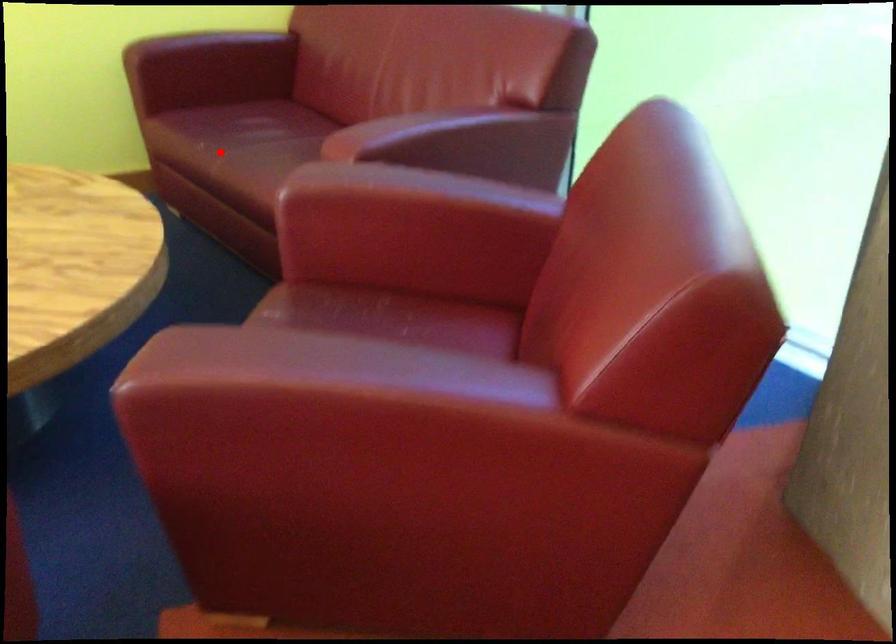
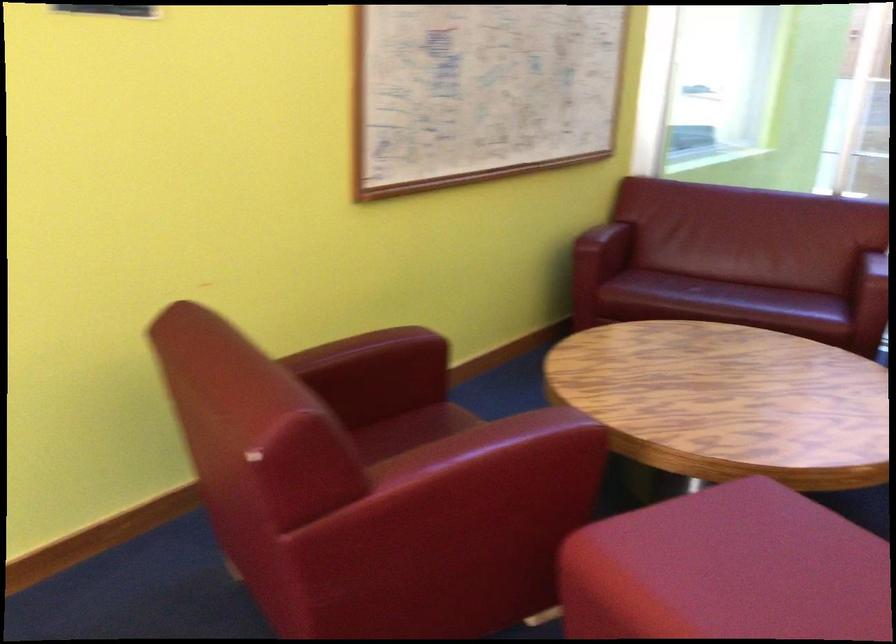
The point at the highlighted location is marked in the first image. Where is the corresponding point in the second image?

(719, 297)